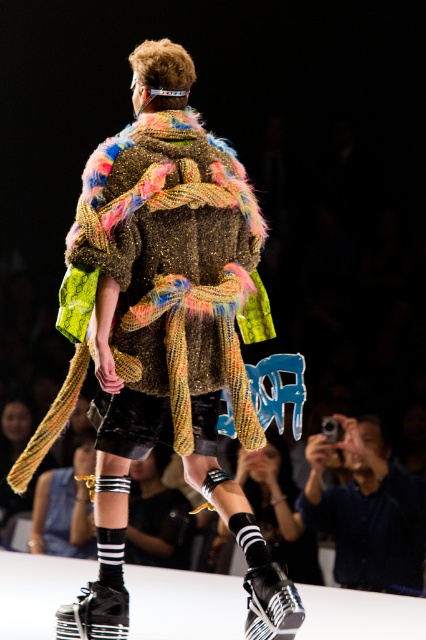
Who is taller, fuzzy multicolored coat at center or blue denim shirt at lower right?

With more height is fuzzy multicolored coat at center.

Can you confirm if fuzzy multicolored coat at center is positioned to the left of blue denim shirt at lower right?

Indeed, fuzzy multicolored coat at center is positioned on the left side of blue denim shirt at lower right.

What are the coordinates of `fuzzy multicolored coat at center` in the screenshot? It's located at click(x=172, y=262).